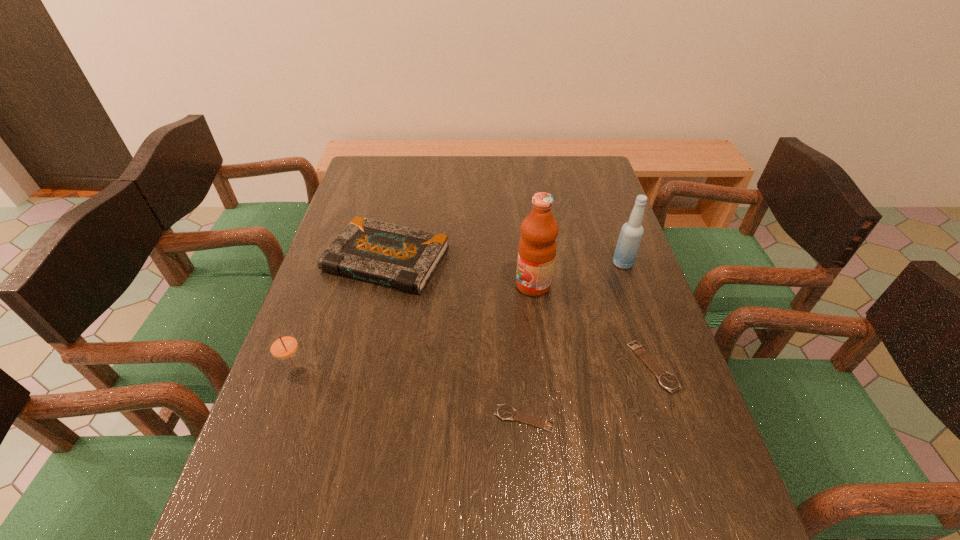
The height and width of the screenshot is (540, 960). I want to click on the shorter watch, so click(x=505, y=412).

Where is `the shortest object`? the shortest object is located at coordinates (505, 412).

Locate an element on the screen. The image size is (960, 540). the farther watch is located at coordinates 666,380.

Where is `the fifth tallest object`? the fifth tallest object is located at coordinates (666, 380).

Where is `the tallest object`? the tallest object is located at coordinates (537, 248).

The height and width of the screenshot is (540, 960). Identify the location of the third shortest object. (405, 258).

The height and width of the screenshot is (540, 960). I want to click on bottle, so click(x=631, y=234).

Identify the location of straw. The width and height of the screenshot is (960, 540). (283, 345).

Where is `free space located on the back of the shorter watch`? free space located on the back of the shorter watch is located at coordinates (515, 293).

Locate an element on the screen. vacant region located on the left of the farther watch is located at coordinates (554, 367).